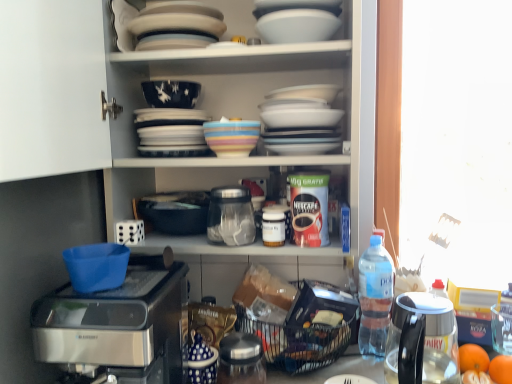
Question: Can you confirm if dark blue glossy bowl at upper center is bigger than orange matte at lower right, arranged as the 2th tangerine when viewed from the front?

Choices:
 (A) yes
 (B) no

Answer: (A)

Question: Could you tell me if dark blue glossy bowl at upper center is facing orange matte at lower right, arranged as the 2th tangerine when viewed from the front?

Choices:
 (A) yes
 (B) no

Answer: (B)

Question: Is dark blue glossy bowl at upper center at the right side of orange matte at lower right, the first tangerine positioned from the back?

Choices:
 (A) no
 (B) yes

Answer: (A)

Question: From the image's perspective, is dark blue glossy bowl at upper center below orange matte at lower right, arranged as the 2th tangerine when viewed from the front?

Choices:
 (A) no
 (B) yes

Answer: (A)

Question: Is the depth of dark blue glossy bowl at upper center less than that of orange matte at lower right, the first tangerine positioned from the back?

Choices:
 (A) no
 (B) yes

Answer: (A)

Question: Does dark blue glossy bowl at upper center touch orange matte at lower right, the first tangerine positioned from the back?

Choices:
 (A) yes
 (B) no

Answer: (B)

Question: Would you say multicolored ceramic bowl at upper center, which is counted as the second tableware, starting from the top, contains white glossy cabinet at upper center?

Choices:
 (A) yes
 (B) no

Answer: (B)

Question: Are multicolored ceramic bowl at upper center, the 2th tableware when ordered from bottom to top, and white glossy cabinet at upper center beside each other?

Choices:
 (A) no
 (B) yes

Answer: (A)

Question: Does multicolored ceramic bowl at upper center, which is counted as the second tableware, starting from the top, have a greater height compared to white glossy cabinet at upper center?

Choices:
 (A) no
 (B) yes

Answer: (A)

Question: From the image's perspective, does multicolored ceramic bowl at upper center, the 2th tableware when ordered from bottom to top, appear lower than white glossy cabinet at upper center?

Choices:
 (A) yes
 (B) no

Answer: (A)

Question: Does multicolored ceramic bowl at upper center, which is counted as the second tableware, starting from the top, lie behind white glossy cabinet at upper center?

Choices:
 (A) no
 (B) yes

Answer: (B)

Question: Is multicolored ceramic bowl at upper center, the 2th tableware when ordered from bottom to top, bigger than white glossy cabinet at upper center?

Choices:
 (A) yes
 (B) no

Answer: (B)

Question: Considering the relative sizes of white glossy bowl at upper center, positioned as the third tableware in bottom-to-top order, and metallic silver jar at lower center, positioned as the third appliance in top-to-bottom order, in the image provided, is white glossy bowl at upper center, positioned as the third tableware in bottom-to-top order, smaller than metallic silver jar at lower center, positioned as the third appliance in top-to-bottom order,?

Choices:
 (A) no
 (B) yes

Answer: (B)